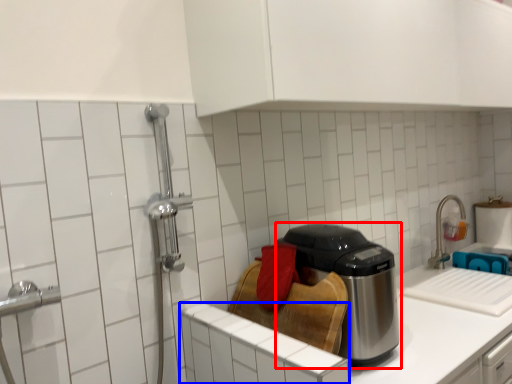
Question: Which object is closer to the camera taking this photo, kitchen appliance (highlighted by a red box) or cabinetry (highlighted by a blue box)?

Choices:
 (A) kitchen appliance
 (B) cabinetry

Answer: (B)